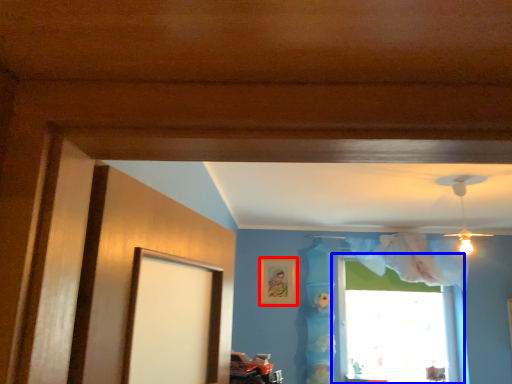
Question: Which of the following is the closest to the observer, picture frame (highlighted by a red box) or window (highlighted by a blue box)?

Choices:
 (A) picture frame
 (B) window

Answer: (B)